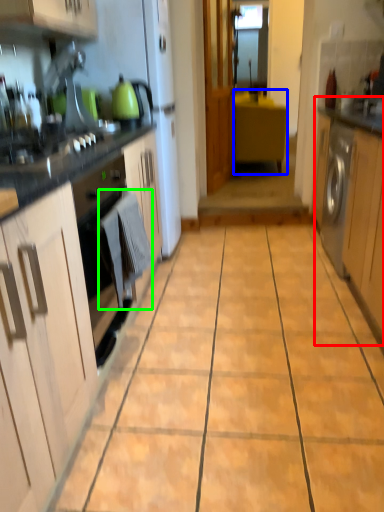
Question: Which object is the farthest from cabinetry (highlighted by a red box)? Choose among these: cabinetry (highlighted by a blue box) or laundry (highlighted by a green box).

Choices:
 (A) cabinetry
 (B) laundry

Answer: (A)